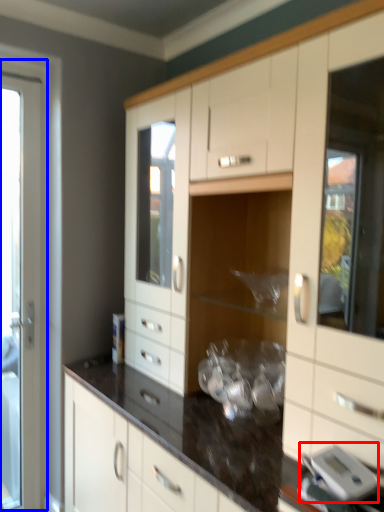
Question: Which of the following is the closest to the observer, appliance (highlighted by a red box) or screen door (highlighted by a blue box)?

Choices:
 (A) appliance
 (B) screen door

Answer: (A)